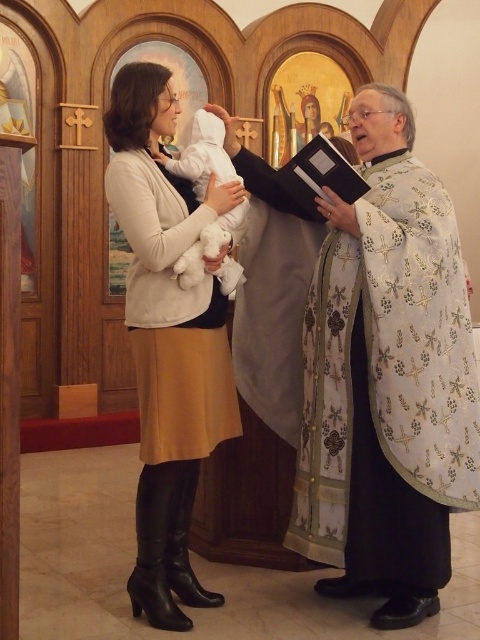
Question: Is white embroidered robe at right in front of matte white sweater at center?

Choices:
 (A) no
 (B) yes

Answer: (A)

Question: Based on their relative distances, which object is farther from the matte white sweater at center?

Choices:
 (A) white plush at center
 (B) white embroidered robe at right

Answer: (B)

Question: Which of the following is the closest to the observer?

Choices:
 (A) (202, 189)
 (B) (142, 476)

Answer: (B)

Question: Can you confirm if white embroidered robe at right is bigger than white plush at center?

Choices:
 (A) yes
 (B) no

Answer: (A)

Question: Can you confirm if white embroidered robe at right is positioned to the left of white plush at center?

Choices:
 (A) no
 (B) yes

Answer: (A)

Question: Which of the following is the closest to the observer?

Choices:
 (A) white embroidered robe at right
 (B) matte white sweater at center
 (C) white plush at center

Answer: (B)